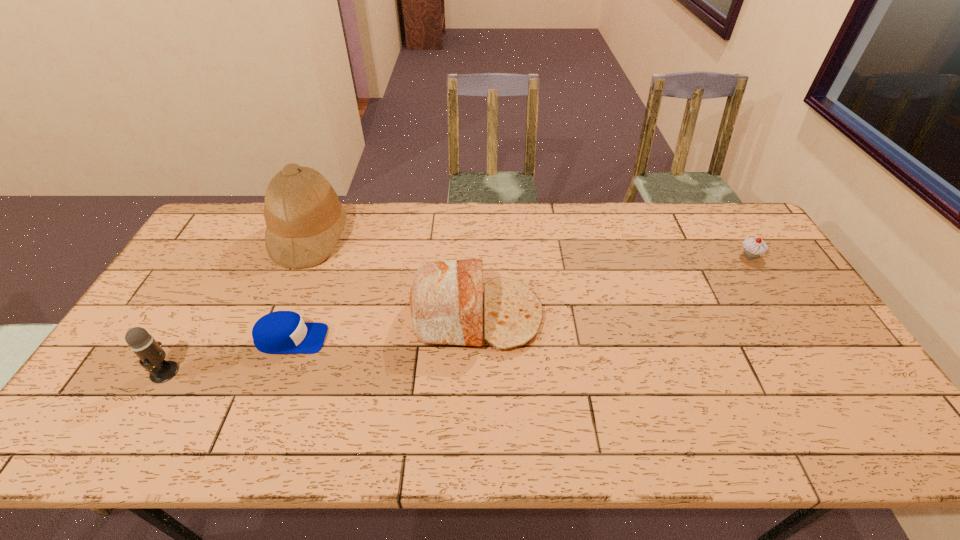
At what (x,y) coordinates should I click in order to perform the action: click on free space between the shortest object and the tallest object. Please return your answer as a coordinate pair (x, y). Looking at the image, I should click on (300, 288).

Where is `unoccupied area between the shortest object and the bread`? Image resolution: width=960 pixels, height=540 pixels. unoccupied area between the shortest object and the bread is located at coordinates (385, 327).

Identify the location of empty space that is in between the baseball cap and the leftmost object. The height and width of the screenshot is (540, 960). (228, 355).

Identify the location of empty space that is in between the shortest object and the tallest object. Image resolution: width=960 pixels, height=540 pixels. (300, 288).

Locate an element on the screen. Image resolution: width=960 pixels, height=540 pixels. free space between the shortest object and the tallest object is located at coordinates (300, 288).

Locate an element on the screen. The width and height of the screenshot is (960, 540). vacant area that lies between the hat and the baseball cap is located at coordinates (300, 288).

In order to click on free spot between the tallest object and the microphone in this screenshot , I will do `click(237, 304)`.

This screenshot has width=960, height=540. I want to click on free space that is in between the shortest object and the second object from right to left, so click(x=385, y=327).

Identify which object is located as the second nearest to the nearest object. Please provide its 2D coordinates. Your answer should be formatted as a tuple, i.e. [(x, y)], where the tuple contains the x and y coordinates of a point satisfying the conditions above.

[(304, 218)]

Select which object appears as the closest to the tallest object. Please provide its 2D coordinates. Your answer should be formatted as a tuple, i.e. [(x, y)], where the tuple contains the x and y coordinates of a point satisfying the conditions above.

[(281, 332)]